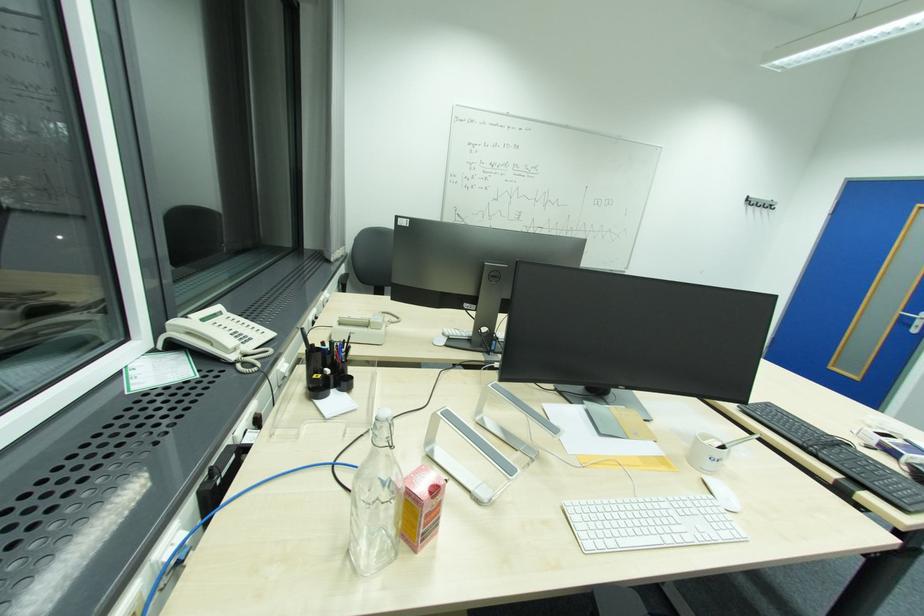
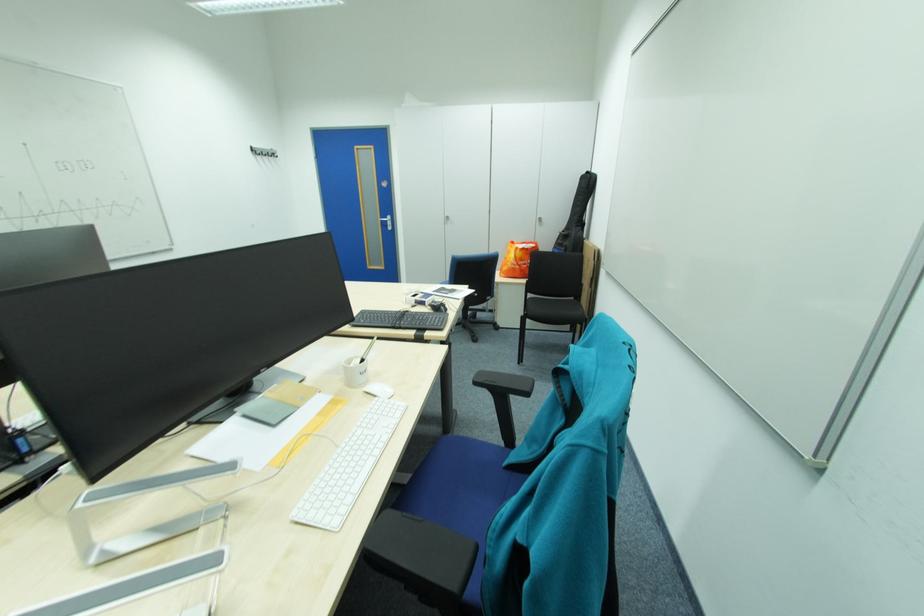
Where in the second image is the point corresponding to the point at 712,440 from the first image?

(359, 363)